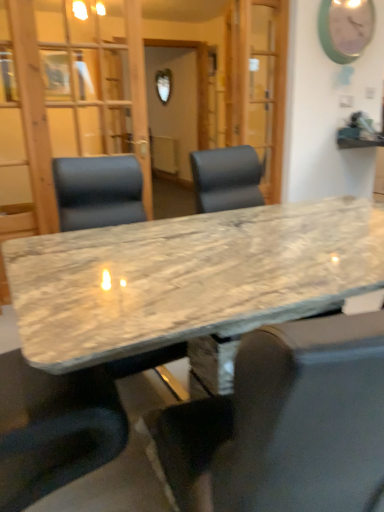
Question: In the image, is matte green clock at upper right positioned in front of or behind marble table at center, the second chair viewed from the back?

Choices:
 (A) behind
 (B) front

Answer: (A)

Question: In terms of height, does matte green clock at upper right look taller or shorter compared to marble table at center, the first chair viewed from the front?

Choices:
 (A) tall
 (B) short

Answer: (B)

Question: Estimate the real-world distances between objects in this image. Which object is farther from the marble table at center, which ranks as the second chair in left-to-right order?

Choices:
 (A) leather-like black chair at center, which is counted as the first chair, starting from the back
 (B) transparent glass door at center
 (C) matte green clock at upper right
 (D) marble table at center

Answer: (C)

Question: Which object is positioned farthest from the leather-like black chair at center, acting as the second chair starting from the right?

Choices:
 (A) marble table at center, the second chair viewed from the back
 (B) marble table at center
 (C) matte green clock at upper right
 (D) transparent glass door at center

Answer: (C)